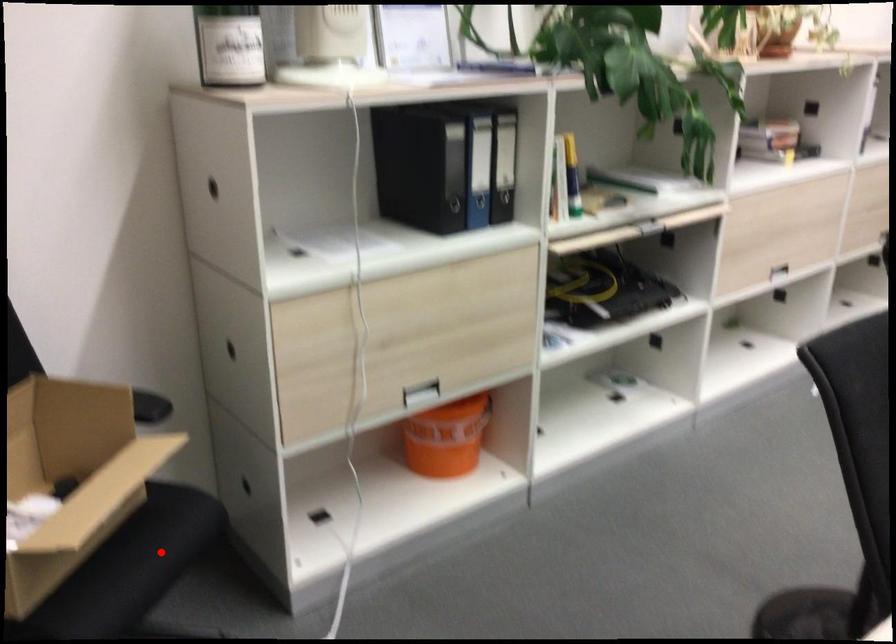
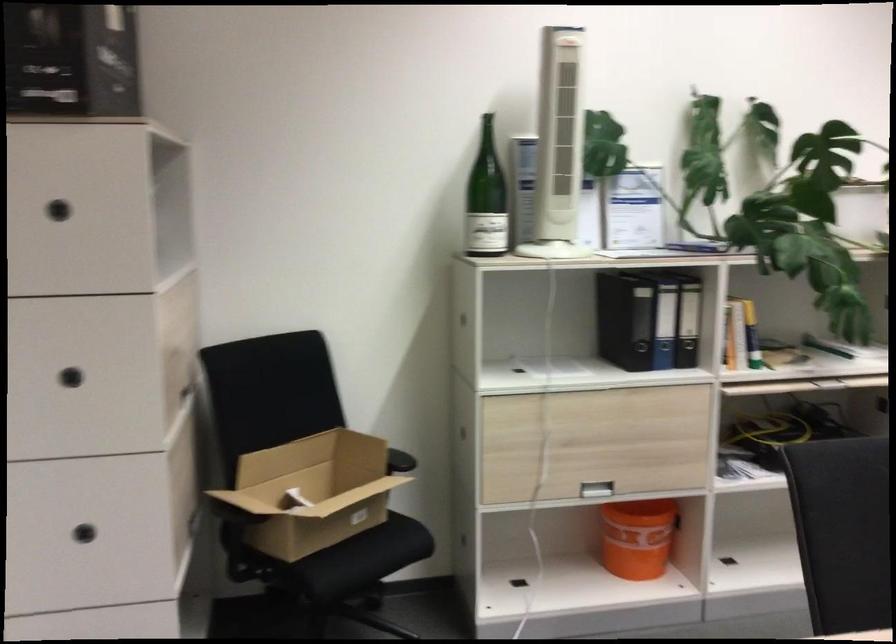
The point at the highlighted location is marked in the first image. Where is the corresponding point in the second image?

(381, 545)